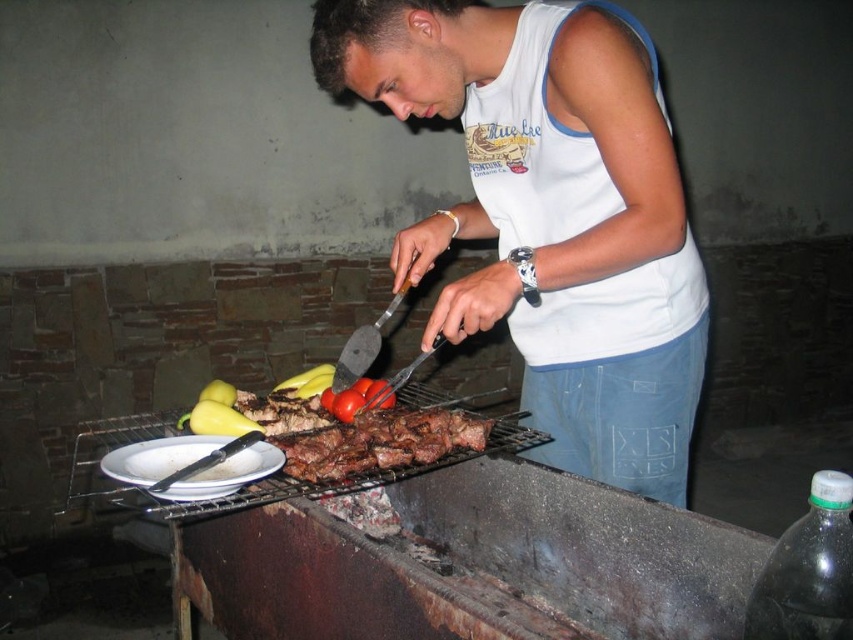
You are a photographer trying to capture the grilling scene. You want to focus on the white cotton tank top at center and the metallic silver tong at lower left. Based on their positions, which object should you adjust your camera focus on first if you want to ensure both are in focus?

The white cotton tank top at center is above the metallic silver tong at lower left, so you should focus on the metallic silver tong at lower left first since it is closer to the camera. This way, the tank top will naturally come into focus as it is further back.

From the picture: You are a chef preparing a meal and notice the metallic silver tong at lower left and the yellow smooth pepper at lower left. Which object is closer to you when you look at the scene?

The metallic silver tong at lower left is closer to you because it is in front of the yellow smooth pepper at lower left.